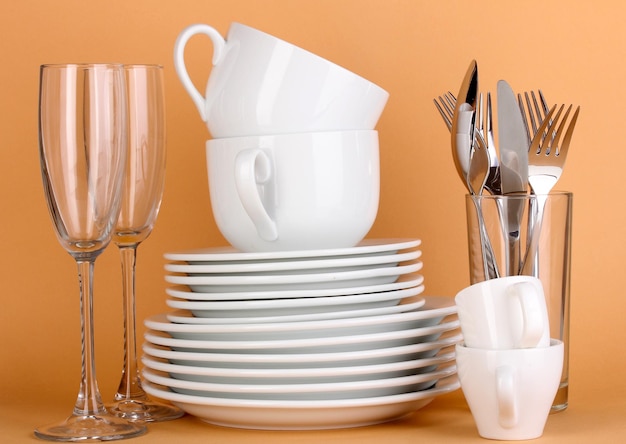
Find the location of a particular element. This screenshot has height=444, width=626. cups is located at coordinates (319, 88), (312, 175), (486, 319), (501, 371).